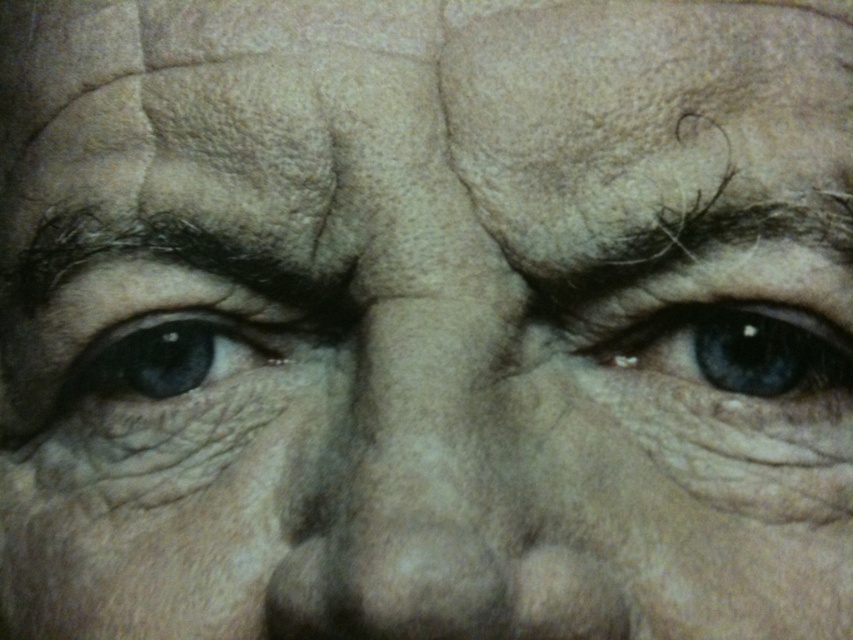
Question: Can you confirm if blue matte eye at center is positioned to the right of dark brown furrowed eyebrow at upper left?

Choices:
 (A) no
 (B) yes

Answer: (B)

Question: Which point is farther to the camera?

Choices:
 (A) (418, 346)
 (B) (781, 330)
 (C) (151, 385)

Answer: (C)

Question: Is smooth skin nose at center bigger than matte blue eye at left?

Choices:
 (A) no
 (B) yes

Answer: (B)

Question: Which of the following is the farthest from the observer?

Choices:
 (A) (247, 321)
 (B) (65, 250)
 (C) (679, 104)
 (D) (287, 589)

Answer: (A)

Question: Is the position of dry skin at center more distant than that of matte blue eye at left?

Choices:
 (A) no
 (B) yes

Answer: (A)

Question: Which point is farther to the camera?

Choices:
 (A) blue matte eye at center
 (B) matte blue eye at left
 (C) smooth skin nose at center
 (D) dry skin at center

Answer: (B)